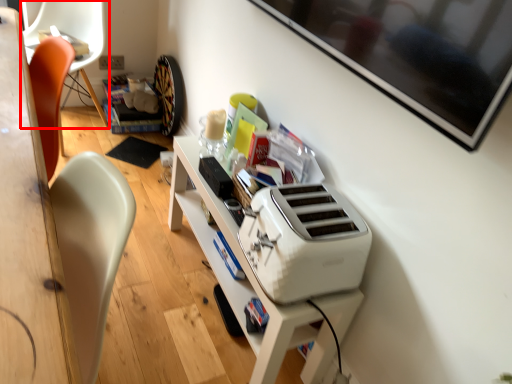
Question: Where is chair (annotated by the red box) located in relation to home appliance in the image?

Choices:
 (A) right
 (B) left

Answer: (B)